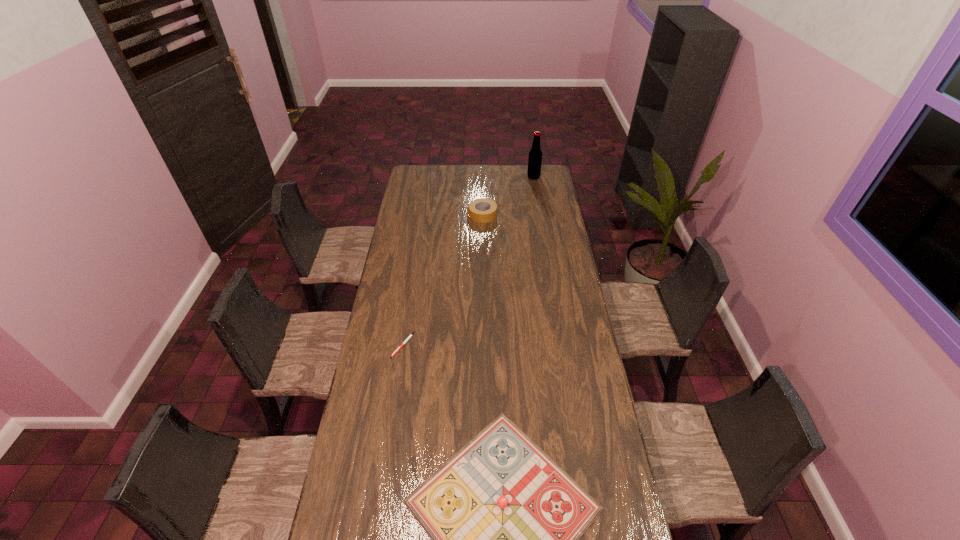
Find the location of a particular element. This screenshot has width=960, height=540. vacant space that is in between the shortest object and the beer bottle is located at coordinates (468, 261).

I want to click on free point between the third nearest object and the shortest object, so click(443, 280).

Identify which object is the second nearest to the duct tape. Please provide its 2D coordinates. Your answer should be formatted as a tuple, i.e. [(x, y)], where the tuple contains the x and y coordinates of a point satisfying the conditions above.

[(410, 336)]

Find the location of a particular element. This screenshot has height=540, width=960. the closest object to the third nearest object is located at coordinates (535, 155).